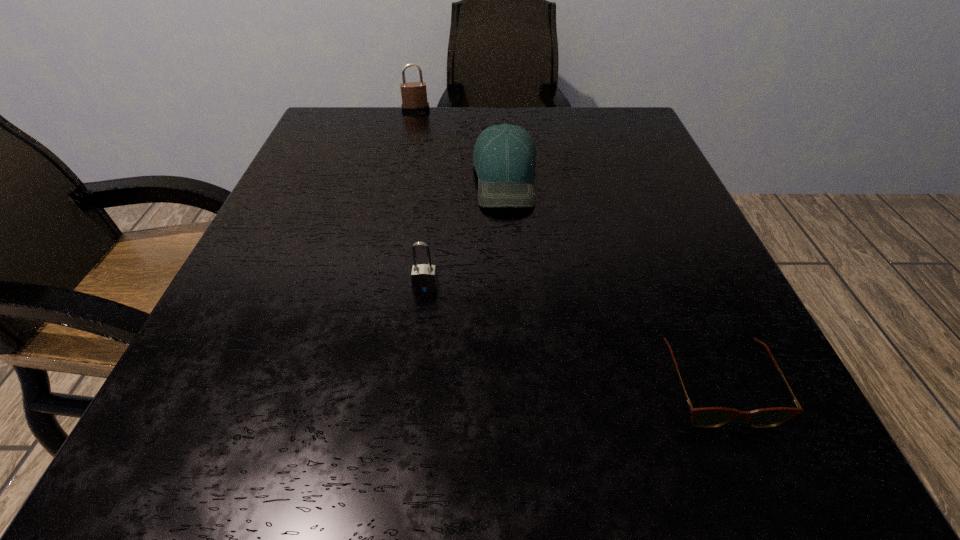
The height and width of the screenshot is (540, 960). Find the location of `the farther padlock`. the farther padlock is located at coordinates (414, 94).

At what (x,y) coordinates should I click in order to perform the action: click on the tallest object. Please return your answer as a coordinate pair (x, y). The width and height of the screenshot is (960, 540). Looking at the image, I should click on (414, 94).

Identify the location of the shorter padlock. The width and height of the screenshot is (960, 540). (424, 278).

Identify the location of the nearer padlock. The image size is (960, 540). (424, 278).

The width and height of the screenshot is (960, 540). In order to click on the second farthest object in this screenshot , I will do `click(504, 157)`.

Where is `the second object from right to left`? the second object from right to left is located at coordinates (504, 157).

Locate an element on the screen. the rightmost object is located at coordinates (708, 417).

Locate an element on the screen. The image size is (960, 540). spectacles is located at coordinates (708, 417).

Where is `vacant position located on the left of the tallest object`? vacant position located on the left of the tallest object is located at coordinates (381, 110).

Locate an element on the screen. free space located on the shackle of the second nearest object is located at coordinates tap(407, 446).